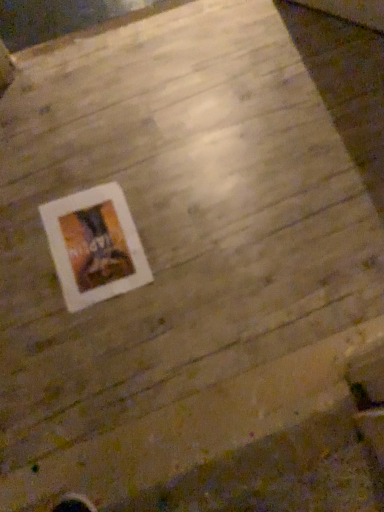
This screenshot has height=512, width=384. I want to click on vacant space situated above white matte picture frame at center (from a real-world perspective), so click(x=92, y=239).